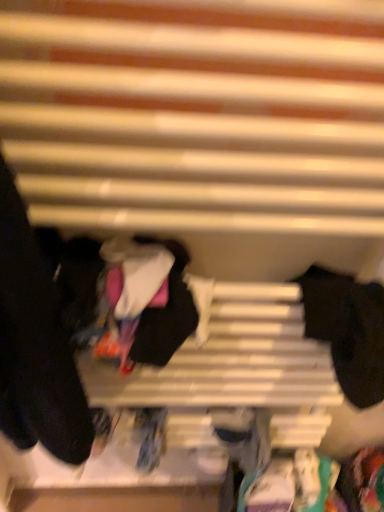
Describe the element at coordinates (35, 345) in the screenshot. This screenshot has width=384, height=512. I see `black matte socks at left, acting as the 2th clothing starting from the right` at that location.

This screenshot has height=512, width=384. I want to click on black matte socks at left, acting as the 2th clothing starting from the right, so click(35, 345).

Measure the distance between point (52,320) and camera.

They are 21.34 inches apart.

Describe the element at coordinates (348, 330) in the screenshot. Image resolution: width=384 pixels, height=512 pixels. I see `black matte socks at right, placed as the second clothing when sorted from left to right` at that location.

This screenshot has width=384, height=512. In order to click on black matte socks at right, which is the 1th clothing from right to left in this screenshot , I will do `click(348, 330)`.

You are a GUI agent. You are given a task and a screenshot of the screen. Output one action in this format:
    pyautogui.click(x=<x>, y=<y>)
    Task: Click on the black matte socks at left, acting as the 2th clothing starting from the right
    
    Given the screenshot: What is the action you would take?
    pyautogui.click(x=35, y=345)

Based on their positions, is black matte socks at right, placed as the second clothing when sorted from left to right, located to the left or right of black matte socks at left, which is the 1th clothing from left to right?

Based on their positions, black matte socks at right, placed as the second clothing when sorted from left to right, is located to the right of black matte socks at left, which is the 1th clothing from left to right.

Looking at this image, between black matte socks at right, which is the 1th clothing from right to left, and black matte socks at left, acting as the 2th clothing starting from the right, which one is positioned behind?

black matte socks at right, which is the 1th clothing from right to left, is behind.

Is point (334, 274) positioned after point (52, 452)?

That is False.

From the image's perspective, is black matte socks at right, which is the 1th clothing from right to left, below black matte socks at left, which is the 1th clothing from left to right?

Correct, black matte socks at right, which is the 1th clothing from right to left, appears lower than black matte socks at left, which is the 1th clothing from left to right, in the image.

From a real-world perspective, is black matte socks at right, placed as the second clothing when sorted from left to right, physically located above or below black matte socks at left, which is the 1th clothing from left to right?

Clearly, from a real-world perspective, black matte socks at right, placed as the second clothing when sorted from left to right, is below black matte socks at left, which is the 1th clothing from left to right.

Considering the sizes of objects black matte socks at right, which is the 1th clothing from right to left, and black matte socks at left, which is the 1th clothing from left to right, in the image provided, who is thinner, black matte socks at right, which is the 1th clothing from right to left, or black matte socks at left, which is the 1th clothing from left to right,?

Thinner between the two is black matte socks at right, which is the 1th clothing from right to left.

Between black matte socks at right, placed as the second clothing when sorted from left to right, and black matte socks at left, which is the 1th clothing from left to right, which one has less height?

Standing shorter between the two is black matte socks at right, placed as the second clothing when sorted from left to right.

Which of these two, black matte socks at right, which is the 1th clothing from right to left, or black matte socks at left, which is the 1th clothing from left to right, is smaller?

Smaller between the two is black matte socks at right, which is the 1th clothing from right to left.

Is black matte socks at left, which is the 1th clothing from left to right, surrounded by black matte socks at right, which is the 1th clothing from right to left?

No, black matte socks at right, which is the 1th clothing from right to left, does not contain black matte socks at left, which is the 1th clothing from left to right.

Is black matte socks at right, placed as the second clothing when sorted from left to right, placed right next to black matte socks at left, which is the 1th clothing from left to right?

No, black matte socks at right, placed as the second clothing when sorted from left to right, is not touching black matte socks at left, which is the 1th clothing from left to right.

Is black matte socks at right, placed as the second clothing when sorted from left to right, aimed at black matte socks at left, acting as the 2th clothing starting from the right?

No, black matte socks at right, placed as the second clothing when sorted from left to right, is not oriented towards black matte socks at left, acting as the 2th clothing starting from the right.

Locate an element on the screen. clothing that is below the black matte socks at left, acting as the 2th clothing starting from the right (from the image's perspective) is located at coordinates pyautogui.click(x=348, y=330).

Is black matte socks at left, acting as the 2th clothing starting from the right, at the right side of black matte socks at right, which is the 1th clothing from right to left?

In fact, black matte socks at left, acting as the 2th clothing starting from the right, is to the left of black matte socks at right, which is the 1th clothing from right to left.

Which object is further away from the camera, black matte socks at left, which is the 1th clothing from left to right, or black matte socks at right, which is the 1th clothing from right to left?

black matte socks at right, which is the 1th clothing from right to left.

Is point (48, 355) less distant than point (323, 312)?

That is True.

From the image's perspective, who appears lower, black matte socks at left, which is the 1th clothing from left to right, or black matte socks at right, which is the 1th clothing from right to left?

black matte socks at right, which is the 1th clothing from right to left, from the image's perspective.

From a real-world perspective, is black matte socks at left, which is the 1th clothing from left to right, on top of black matte socks at right, which is the 1th clothing from right to left?

Yes, from a real-world perspective, black matte socks at left, which is the 1th clothing from left to right, is above black matte socks at right, which is the 1th clothing from right to left.

Between black matte socks at left, acting as the 2th clothing starting from the right, and black matte socks at right, placed as the second clothing when sorted from left to right, which one has smaller width?

black matte socks at right, placed as the second clothing when sorted from left to right.

Based on the photo, considering the sizes of objects black matte socks at left, which is the 1th clothing from left to right, and black matte socks at right, placed as the second clothing when sorted from left to right, in the image provided, who is taller, black matte socks at left, which is the 1th clothing from left to right, or black matte socks at right, placed as the second clothing when sorted from left to right,?

Standing taller between the two is black matte socks at left, which is the 1th clothing from left to right.

Can you confirm if black matte socks at left, which is the 1th clothing from left to right, is smaller than black matte socks at right, which is the 1th clothing from right to left?

No, black matte socks at left, which is the 1th clothing from left to right, is not smaller than black matte socks at right, which is the 1th clothing from right to left.

Would you say black matte socks at left, which is the 1th clothing from left to right, contains black matte socks at right, which is the 1th clothing from right to left?

Actually, black matte socks at right, which is the 1th clothing from right to left, is outside black matte socks at left, which is the 1th clothing from left to right.

Is black matte socks at left, which is the 1th clothing from left to right, placed right next to black matte socks at right, which is the 1th clothing from right to left?

black matte socks at left, which is the 1th clothing from left to right, and black matte socks at right, which is the 1th clothing from right to left, are clearly separated.

Is black matte socks at left, acting as the 2th clothing starting from the right, aimed at black matte socks at right, placed as the second clothing when sorted from left to right?

No, black matte socks at left, acting as the 2th clothing starting from the right, is not facing towards black matte socks at right, placed as the second clothing when sorted from left to right.

At what (x,y) coordinates should I click in order to perform the action: click on clothing above the black matte socks at right, placed as the second clothing when sorted from left to right (from the image's perspective). Please return your answer as a coordinate pair (x, y). The image size is (384, 512). Looking at the image, I should click on (35, 345).

Locate an element on the screen. clothing lying behind the black matte socks at left, which is the 1th clothing from left to right is located at coordinates (348, 330).

The width and height of the screenshot is (384, 512). I want to click on clothing above the black matte socks at right, placed as the second clothing when sorted from left to right (from a real-world perspective), so click(35, 345).